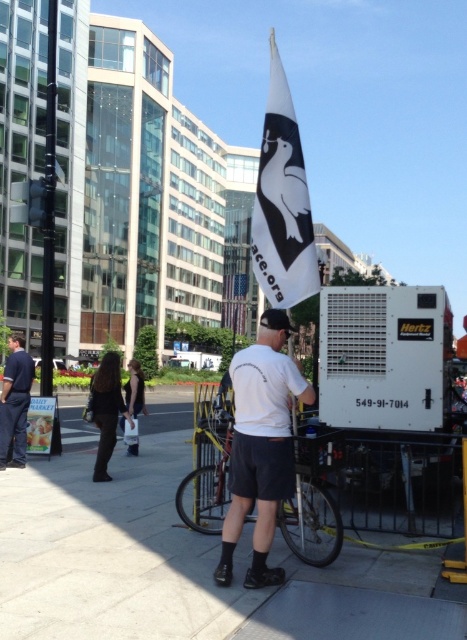
You are a delivery person needing to place a small package on either the dark blue jeans at lower left or the black fabric bag at center. Which surface is wider and can accommodate the package?

The dark blue jeans at lower left is wider than the black fabric bag at center, so the package can be placed on the dark blue jeans at lower left.